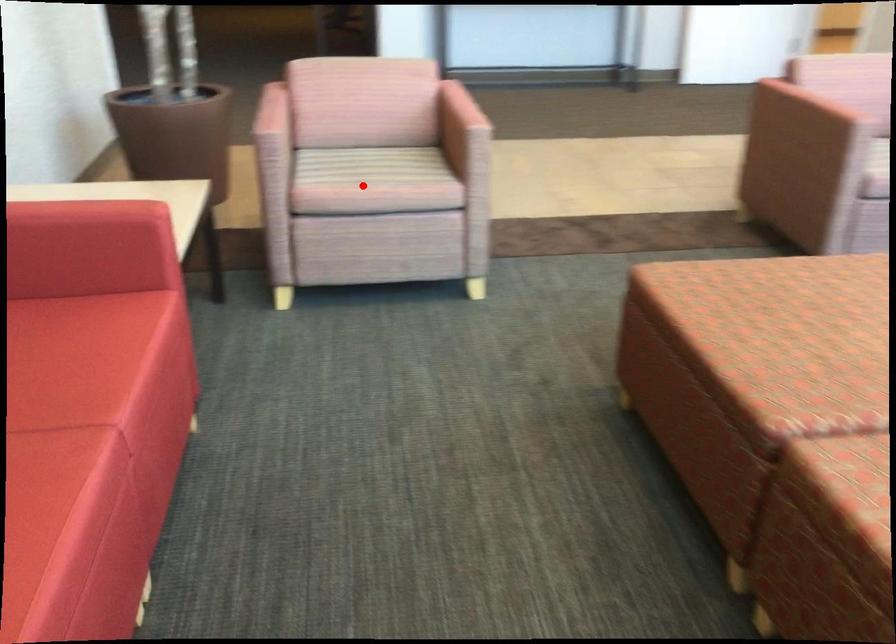
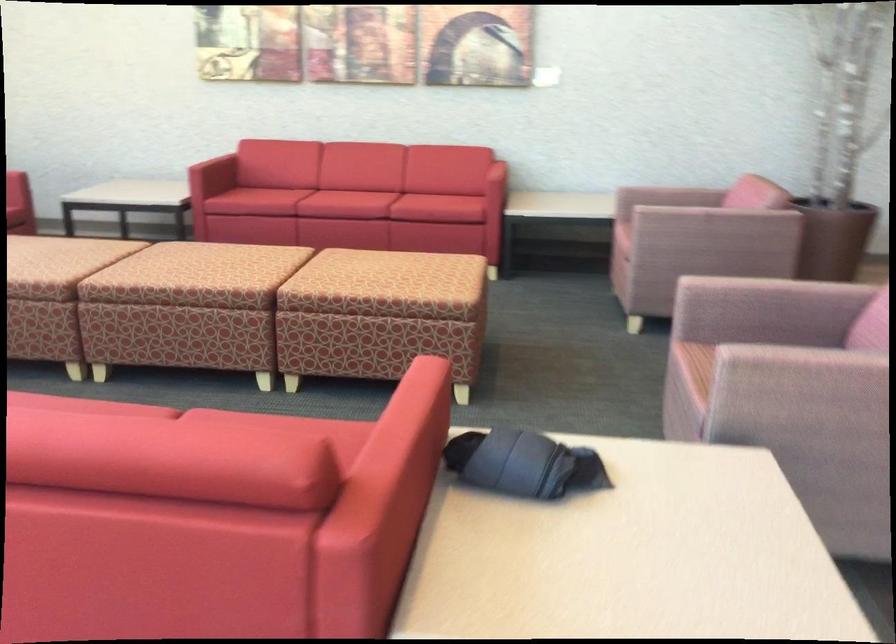
Where in the second image is the point corresponding to the highlighted location from the first image?

(624, 218)